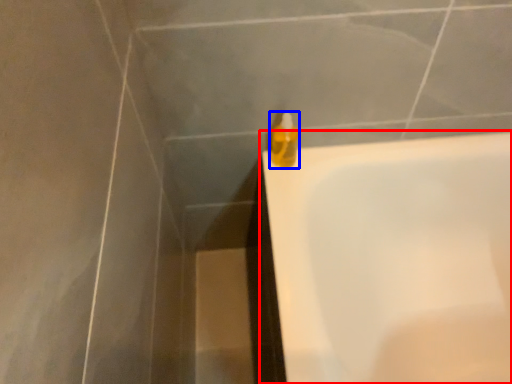
Question: Which object appears farthest to the camera in this image, bathtub (highlighted by a red box) or liquid (highlighted by a blue box)?

Choices:
 (A) bathtub
 (B) liquid

Answer: (B)